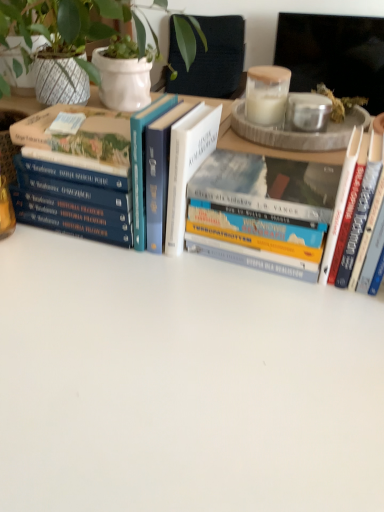
Question: Which direction should I rotate to look at hardcover book at center, which ranks as the second book in right-to-left order?

Choices:
 (A) right
 (B) left

Answer: (A)

Question: Can we say hardcover book at left, acting as the first book starting from the left, lies outside hardcover book at right, which appears as the 1th book when viewed from the right?

Choices:
 (A) yes
 (B) no

Answer: (A)

Question: Is hardcover book at left, acting as the first book starting from the left, shorter than hardcover book at right, which is the 3th book from left to right?

Choices:
 (A) yes
 (B) no

Answer: (A)

Question: Considering the relative sizes of hardcover book at left, acting as the first book starting from the left, and hardcover book at right, which appears as the 1th book when viewed from the right, in the image provided, is hardcover book at left, acting as the first book starting from the left, thinner than hardcover book at right, which appears as the 1th book when viewed from the right,?

Choices:
 (A) no
 (B) yes

Answer: (B)

Question: Considering the relative positions of hardcover book at left, which is the third book in right-to-left order, and hardcover book at right, which appears as the 1th book when viewed from the right, in the image provided, is hardcover book at left, which is the third book in right-to-left order, behind hardcover book at right, which appears as the 1th book when viewed from the right,?

Choices:
 (A) no
 (B) yes

Answer: (B)

Question: Is hardcover book at left, acting as the first book starting from the left, aimed at hardcover book at right, which is the 3th book from left to right?

Choices:
 (A) yes
 (B) no

Answer: (B)

Question: From a real-world perspective, is hardcover book at left, acting as the first book starting from the left, on top of hardcover book at right, which is the 3th book from left to right?

Choices:
 (A) no
 (B) yes

Answer: (B)

Question: Can you confirm if hardcover book at center, which is the 2th book in left-to-right order, is shorter than hardcover book at right, which is the 3th book from left to right?

Choices:
 (A) no
 (B) yes

Answer: (B)

Question: From the image's perspective, is hardcover book at center, which is the 2th book in left-to-right order, located beneath hardcover book at right, which appears as the 1th book when viewed from the right?

Choices:
 (A) yes
 (B) no

Answer: (B)

Question: Is hardcover book at center, which is the 2th book in left-to-right order, smaller than hardcover book at right, which appears as the 1th book when viewed from the right?

Choices:
 (A) yes
 (B) no

Answer: (B)

Question: Is hardcover book at center, which is the 2th book in left-to-right order, at the left side of hardcover book at right, which is the 3th book from left to right?

Choices:
 (A) no
 (B) yes

Answer: (B)

Question: Is there a large distance between hardcover book at center, which ranks as the second book in right-to-left order, and hardcover book at right, which is the 3th book from left to right?

Choices:
 (A) no
 (B) yes

Answer: (A)

Question: Is hardcover book at center, which is the 2th book in left-to-right order, taller than hardcover book at right, which is the 3th book from left to right?

Choices:
 (A) no
 (B) yes

Answer: (A)

Question: From a real-world perspective, is hardcover book at left, which is the third book in right-to-left order, on top of hardcover book at center, which is the 2th book in left-to-right order?

Choices:
 (A) yes
 (B) no

Answer: (A)